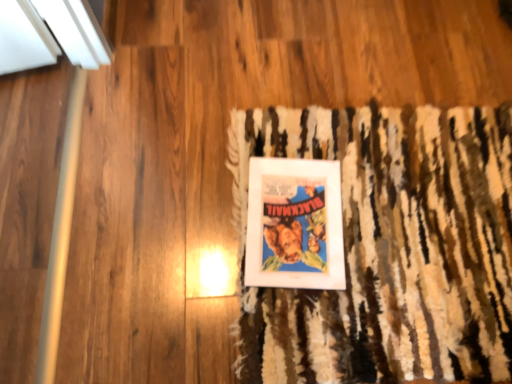
Identify the location of unoccupied space behind matte paper poster at center. This screenshot has width=512, height=384. (314, 130).